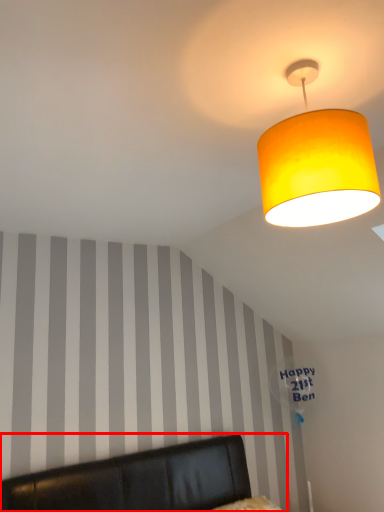
Question: From the image's perspective, what is the correct spatial positioning of furniture (annotated by the red box) in reference to lamp?

Choices:
 (A) above
 (B) below

Answer: (B)